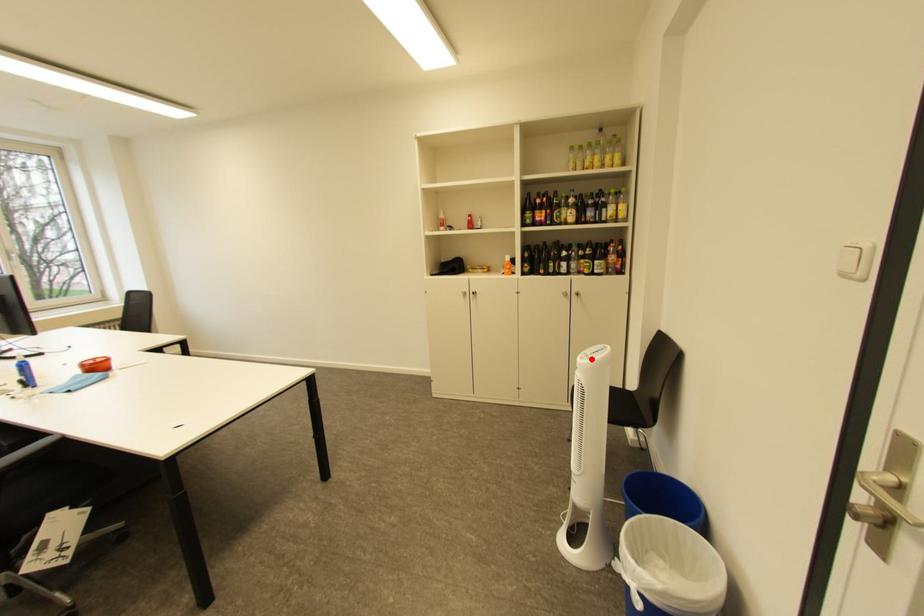
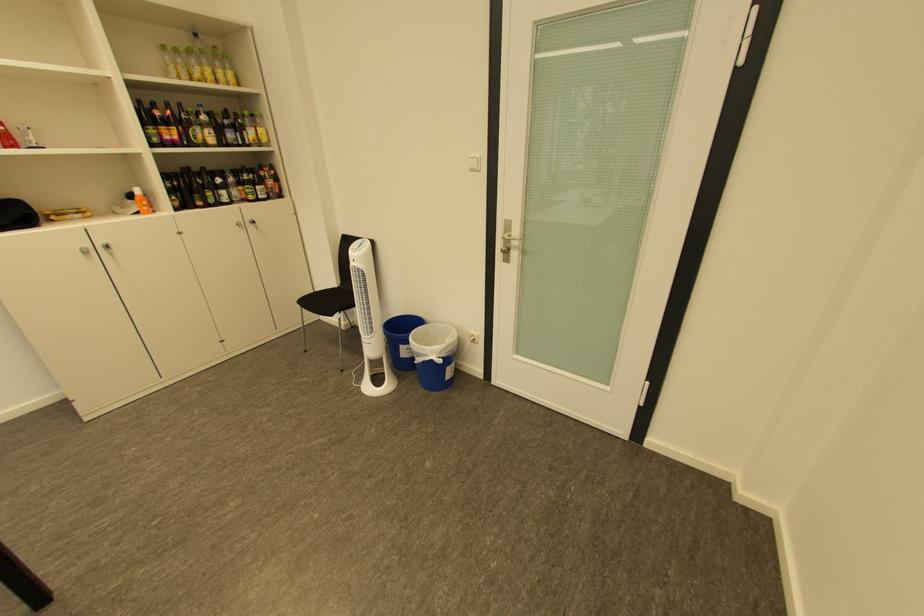
Question: A red point is marked in image1. In image2, is the corresponding 3D point closer to the camera or farther? Reply with the corresponding letter.

Choices:
 (A) The corresponding 3D point is closer.
 (B) The corresponding 3D point is farther.

Answer: (A)